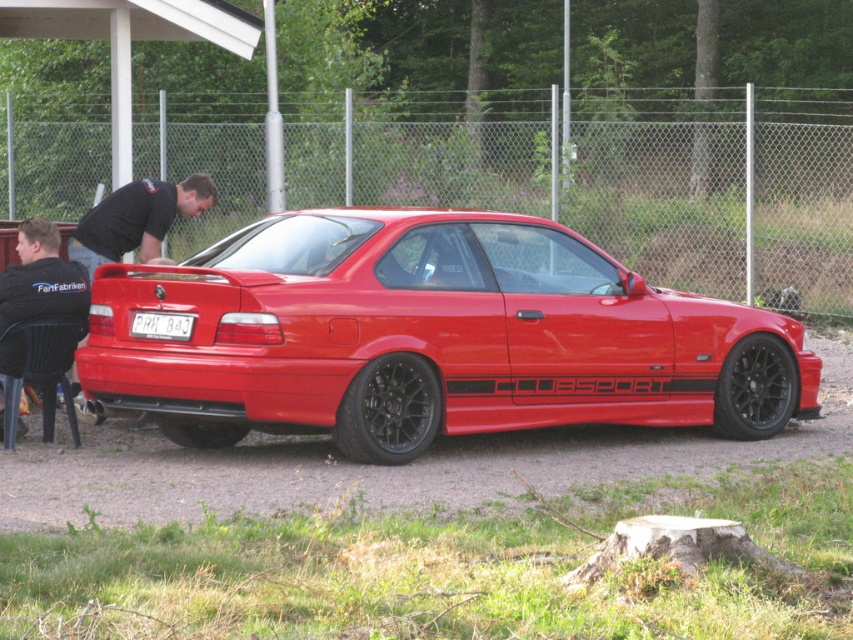
You are a photographer wanting to capture the glossy red sports car at center and the black matte tire at center in a single shot. Since you want to emphasize the car, where should you position the camera relative to the car and tire?

Since the glossy red sports car at center is much taller than the black matte tire at center, positioning the camera at a lower angle facing upwards would emphasize the height of the car compared to the tire, making it the focal point of the shot.

A drone is flying at a height of 10 meters above the ground. It needs to capture a photo of the point at coordinates point (576, 291) while avoiding the fence. What is the minimum horizontal distance the drone must maintain from the fence to ensure the entire car is visible in the photo?

The point at coordinates point (576, 291) is 8.91 meters away from the fence. To ensure the entire car is visible while avoiding the fence, the drone must maintain a minimum horizontal distance of 8.91 meters from the fence.